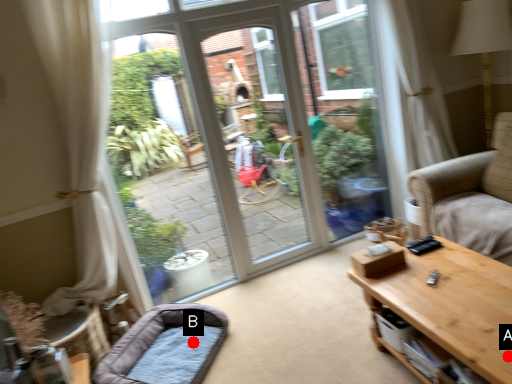
Question: Two points are circled on the image, labeled by A and B beside each circle. Which point is closer to the camera taking this photo?

Choices:
 (A) A is closer
 (B) B is closer

Answer: (A)